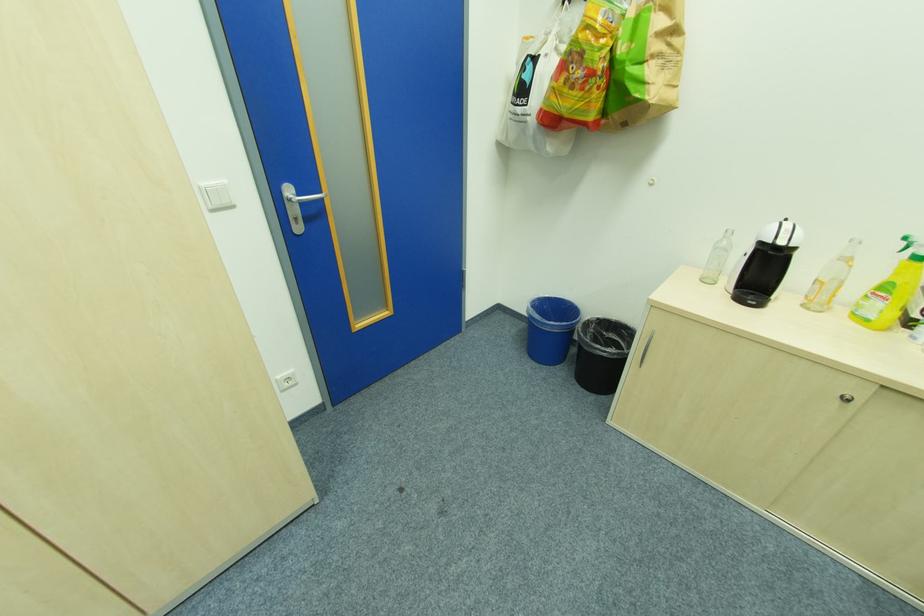
The image size is (924, 616). Describe the element at coordinates (845, 398) in the screenshot. I see `the silver cabinet lock` at that location.